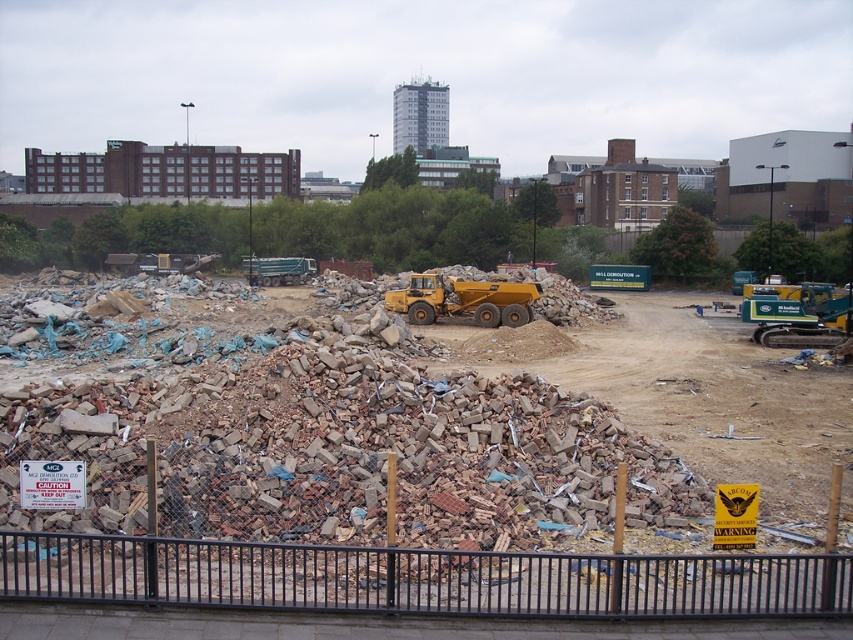
Question: Can you confirm if black metal fence at lower center is bigger than yellow rubber dump truck at center?

Choices:
 (A) no
 (B) yes

Answer: (A)

Question: Does black metal fence at lower center appear on the left side of yellow rubber dump truck at center?

Choices:
 (A) no
 (B) yes

Answer: (B)

Question: Does black metal fence at lower center have a smaller size compared to yellow rubber dump truck at center?

Choices:
 (A) yes
 (B) no

Answer: (A)

Question: Which of the following is the farthest from the observer?

Choices:
 (A) yellow rubber dump truck at center
 (B) black metal fence at lower center

Answer: (A)